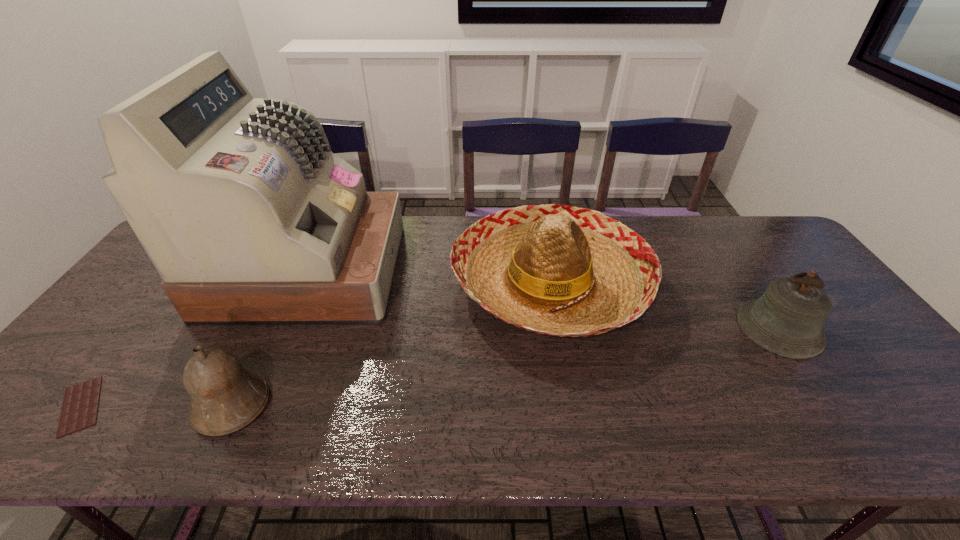
In order to click on vacant space located on the left of the left bell in this screenshot , I will do [x=84, y=406].

Locate an element on the screen. Image resolution: width=960 pixels, height=540 pixels. blank space located 0.300m on the back of the leftmost object is located at coordinates [x=170, y=292].

I want to click on cash register present at the far edge, so click(249, 218).

Find the location of a particular element. This screenshot has height=540, width=960. sombrero that is at the far edge is located at coordinates (552, 269).

The width and height of the screenshot is (960, 540). In order to click on bell situated at the near edge in this screenshot , I will do `click(225, 397)`.

Where is `chocolate bar present at the near edge`? chocolate bar present at the near edge is located at coordinates (80, 405).

The image size is (960, 540). I want to click on object at the left edge, so click(80, 405).

Image resolution: width=960 pixels, height=540 pixels. What are the coordinates of `object present at the right edge` in the screenshot? It's located at (787, 319).

The width and height of the screenshot is (960, 540). I want to click on object that is at the near left corner, so click(80, 405).

The height and width of the screenshot is (540, 960). In the image, there is a desktop. In order to click on vacant space at the far edge in this screenshot , I will do `click(465, 230)`.